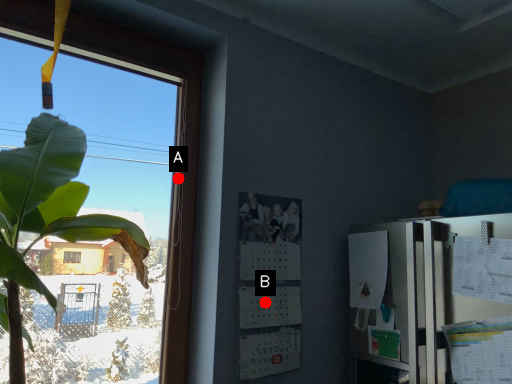
Question: Two points are circled on the image, labeled by A and B beside each circle. Which point appears closest to the camera in this image?

Choices:
 (A) A is closer
 (B) B is closer

Answer: (B)